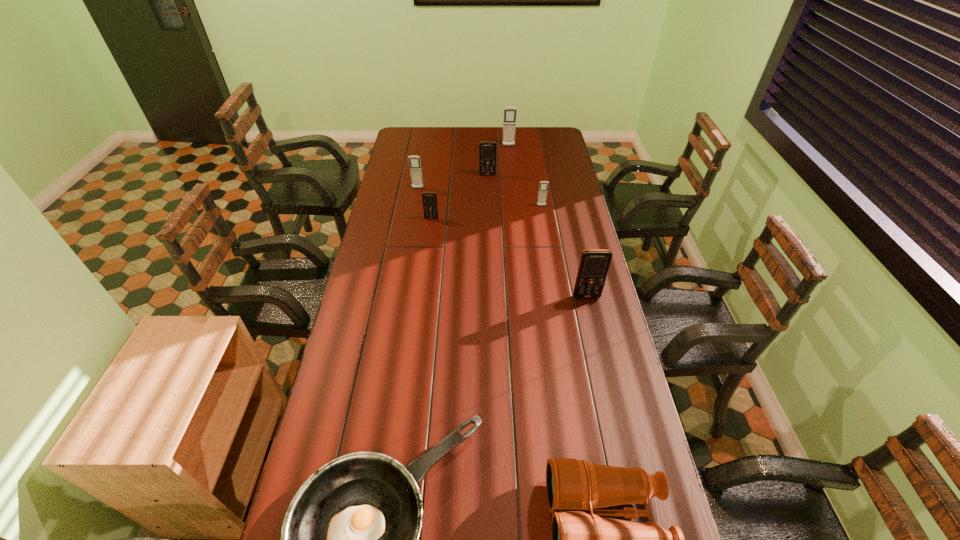
Locate an element on the screen. Image resolution: width=960 pixels, height=540 pixels. the biggest gray cellular telephone is located at coordinates [x=509, y=124].

Where is `the farthest cellular telephone`? This screenshot has height=540, width=960. the farthest cellular telephone is located at coordinates (509, 124).

This screenshot has width=960, height=540. In order to click on the nearest orange cellular telephone in this screenshot , I will do `click(594, 264)`.

Find the location of a particular element. This screenshot has height=540, width=960. the rightmost cellular telephone is located at coordinates (594, 264).

This screenshot has width=960, height=540. Find the location of `the third farthest cellular telephone`. the third farthest cellular telephone is located at coordinates (414, 161).

Where is `the sixth nearest object`? The width and height of the screenshot is (960, 540). the sixth nearest object is located at coordinates (414, 161).

Where is `the second farthest object`? This screenshot has width=960, height=540. the second farthest object is located at coordinates (487, 149).

The image size is (960, 540). I want to click on the second orange cellular telephone from left to right, so click(487, 149).

At what (x,y) coordinates should I click in order to perform the action: click on the second nearest orange cellular telephone. Please return your answer as a coordinate pair (x, y). The width and height of the screenshot is (960, 540). Looking at the image, I should click on (430, 208).

Identify the location of the smallest orange cellular telephone. The height and width of the screenshot is (540, 960). (430, 208).